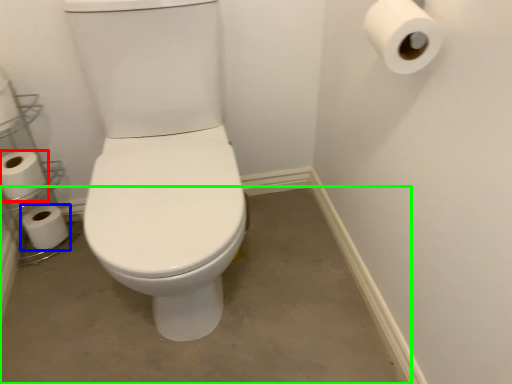
Question: Based on their relative distances, which object is nearer to toilet paper (highlighted by a red box)? Choose from toilet paper (highlighted by a blue box) and concrete (highlighted by a green box).

Choices:
 (A) toilet paper
 (B) concrete

Answer: (A)